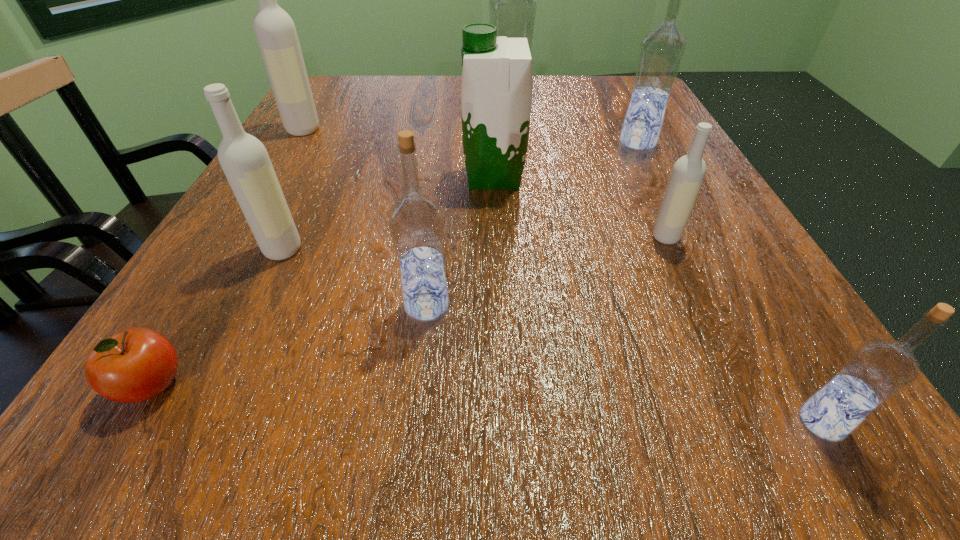
At what (x,y) coordinates should I click in order to perform the action: click on the fourth vodka from right to left. Please return your answer as a coordinate pair (x, y). Looking at the image, I should click on (513, 2).

This screenshot has width=960, height=540. I want to click on the tallest vodka, so click(x=513, y=2).

Identify the location of the biggest white vodka. This screenshot has height=540, width=960. (275, 31).

Locate an element on the screen. This screenshot has width=960, height=540. the leftmost vodka is located at coordinates (275, 31).

Where is `the second farthest blue vodka`? the second farthest blue vodka is located at coordinates (661, 53).

You are a GUI agent. You are given a task and a screenshot of the screen. Output one action in this format:
    pyautogui.click(x=<x>, y=<y>)
    Task: Click on the soya milk
    The height and width of the screenshot is (540, 960).
    Given the screenshot: What is the action you would take?
    pyautogui.click(x=496, y=90)

This screenshot has width=960, height=540. What are the coordinates of `the fourth farthest object` in the screenshot? It's located at (496, 90).

Where is `the seventh object from right to left`? the seventh object from right to left is located at coordinates (246, 164).

At what (x,y) coordinates should I click in order to perform the action: click on the second white vodka from left to right. Please return your answer as a coordinate pair (x, y). The height and width of the screenshot is (540, 960). Looking at the image, I should click on pyautogui.click(x=246, y=164).

The image size is (960, 540). I want to click on the sixth farthest vodka, so point(416,222).